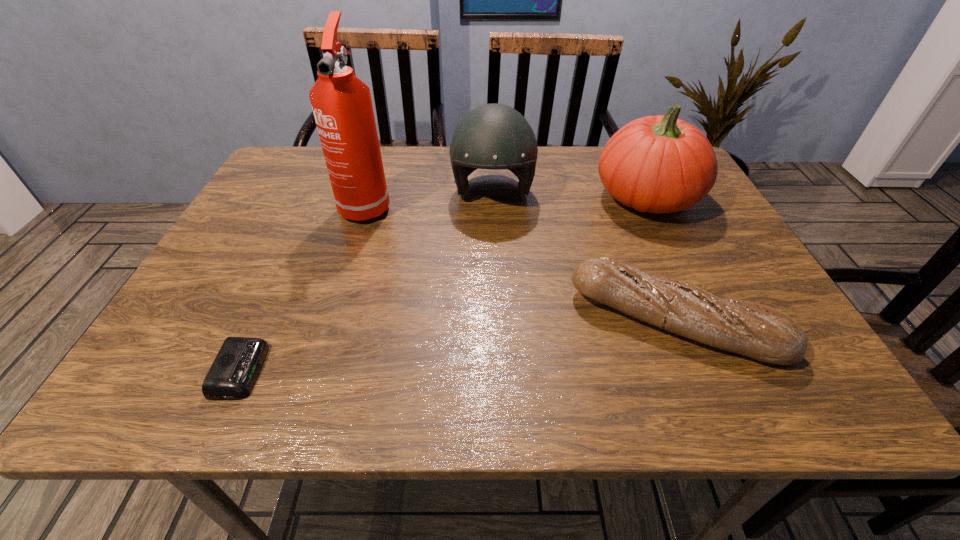
Find the location of a particular element. vacant point located between the third object from right to left and the fourth tallest object is located at coordinates (584, 258).

Locate an element on the screen. The width and height of the screenshot is (960, 540). vacant area that lies between the second shortest object and the tallest object is located at coordinates (520, 263).

Where is `free space between the football helmet and the second object from left to right`? The width and height of the screenshot is (960, 540). free space between the football helmet and the second object from left to right is located at coordinates (429, 199).

At what (x,y) coordinates should I click in order to perform the action: click on free spot between the tallest object and the alarm clock. Please return your answer as a coordinate pair (x, y). The width and height of the screenshot is (960, 540). Looking at the image, I should click on (303, 287).

At what (x,y) coordinates should I click in order to perform the action: click on empty space between the leftmost object and the baguet. Please return your answer as a coordinate pair (x, y). The image size is (960, 540). Looking at the image, I should click on (458, 346).

I want to click on free spot between the fourth object from right to left and the pumpkin, so click(x=507, y=200).

You are a GUI agent. You are given a task and a screenshot of the screen. Output one action in this format:
    pyautogui.click(x=<x>, y=<y>)
    Task: Click on the free area in between the second shortest object and the tallest object
    The height and width of the screenshot is (540, 960).
    Given the screenshot: What is the action you would take?
    pyautogui.click(x=520, y=263)

Find the location of a particular element. Image resolution: width=960 pixels, height=540 pixels. empty space that is in between the fourth tallest object and the tallest object is located at coordinates (520, 263).

Where is `free space between the second object from left to right and the shortest object`? The width and height of the screenshot is (960, 540). free space between the second object from left to right and the shortest object is located at coordinates (303, 287).

Locate an element on the screen. object that stands as the second closest to the baguet is located at coordinates tap(493, 136).